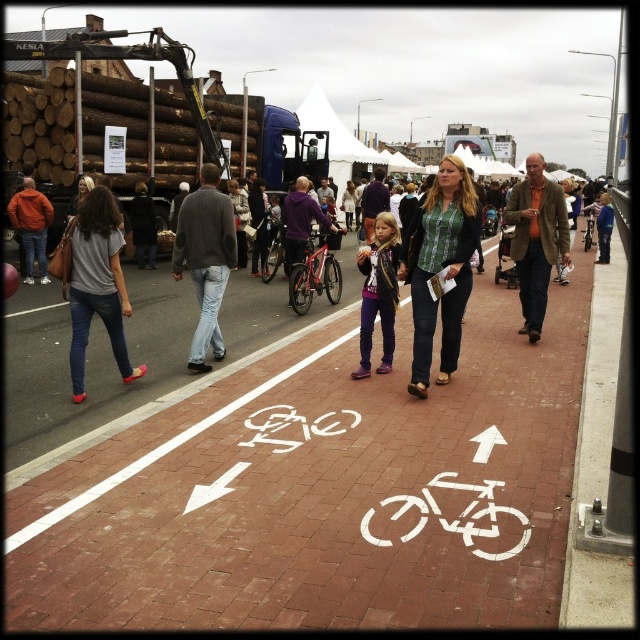
Question: Does green plaid shirt at center appear under shiny red bicycle at center?

Choices:
 (A) no
 (B) yes

Answer: (B)

Question: Is gray wool sweater at center smaller than shiny red bicycle at center?

Choices:
 (A) no
 (B) yes

Answer: (B)

Question: Among these objects, which one is farthest from the camera?

Choices:
 (A) gray wool sweater at center
 (B) green plaid shirt at center
 (C) denim jeans at left

Answer: (A)

Question: Considering the real-world distances, which object is closest to the brick pavement at center?

Choices:
 (A) green plaid shirt at center
 (B) matte purple jacket at center
 (C) denim jeans at left

Answer: (C)

Question: In this image, where is green plaid shirt at center located relative to denim jeans at left?

Choices:
 (A) below
 (B) above

Answer: (B)

Question: Which of the following is the closest to the observer?

Choices:
 (A) (429, 236)
 (B) (116, 205)
 (C) (332, 236)
 (D) (36, 500)

Answer: (D)